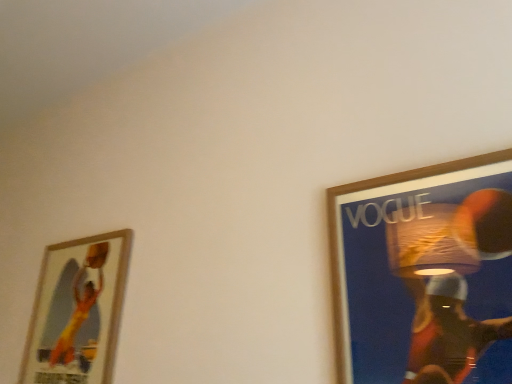
Question: From the image's perspective, is wooden framed poster at left, the second picture frame in the right-to-left sequence, located above or below wooden picture frame at upper right, arranged as the first picture frame when viewed from the right?

Choices:
 (A) below
 (B) above

Answer: (A)

Question: From a real-world perspective, is wooden framed poster at left, the first picture frame viewed from the back, above or below wooden picture frame at upper right, the 2th picture frame from the left?

Choices:
 (A) above
 (B) below

Answer: (A)

Question: Looking at their shapes, would you say wooden framed poster at left, the second picture frame in the right-to-left sequence, is wider or thinner than wooden picture frame at upper right, the second picture frame in the back-to-front sequence?

Choices:
 (A) thin
 (B) wide

Answer: (B)

Question: Based on their sizes in the image, would you say wooden picture frame at upper right, which is the first picture frame in front-to-back order, is bigger or smaller than wooden framed poster at left, the second picture frame in the right-to-left sequence?

Choices:
 (A) small
 (B) big

Answer: (A)

Question: Is wooden picture frame at upper right, the 2th picture frame from the left, inside or outside of wooden framed poster at left, which is the first picture frame in left-to-right order?

Choices:
 (A) inside
 (B) outside

Answer: (B)

Question: From their relative heights in the image, would you say wooden picture frame at upper right, arranged as the first picture frame when viewed from the right, is taller or shorter than wooden framed poster at left, the second picture frame in the right-to-left sequence?

Choices:
 (A) short
 (B) tall

Answer: (A)

Question: Considering the relative positions of wooden picture frame at upper right, which is the first picture frame in front-to-back order, and wooden framed poster at left, which is the first picture frame in left-to-right order, in the image provided, is wooden picture frame at upper right, which is the first picture frame in front-to-back order, to the left or to the right of wooden framed poster at left, which is the first picture frame in left-to-right order,?

Choices:
 (A) right
 (B) left

Answer: (A)